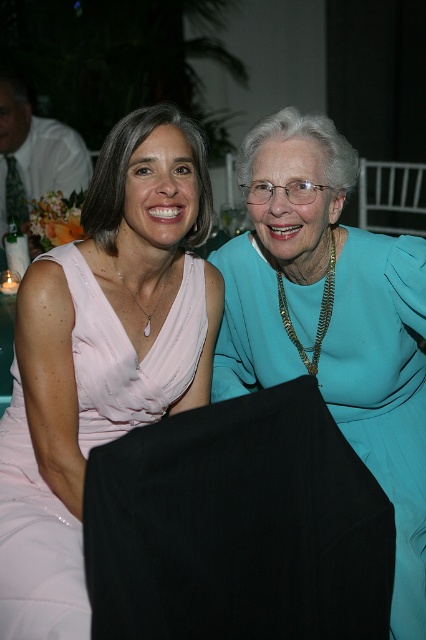
Question: Among these points, which one is nearest to the camera?

Choices:
 (A) (252, 252)
 (B) (198, 314)

Answer: (B)

Question: Which object appears closest to the camera in this image?

Choices:
 (A) satin pink dress at center
 (B) teal satin dress at center

Answer: (A)

Question: Is teal satin dress at center below satin pink dress at center?

Choices:
 (A) yes
 (B) no

Answer: (A)

Question: Does teal satin dress at center lie in front of satin pink dress at center?

Choices:
 (A) no
 (B) yes

Answer: (A)

Question: Can you confirm if teal satin dress at center is wider than satin pink dress at center?

Choices:
 (A) yes
 (B) no

Answer: (A)